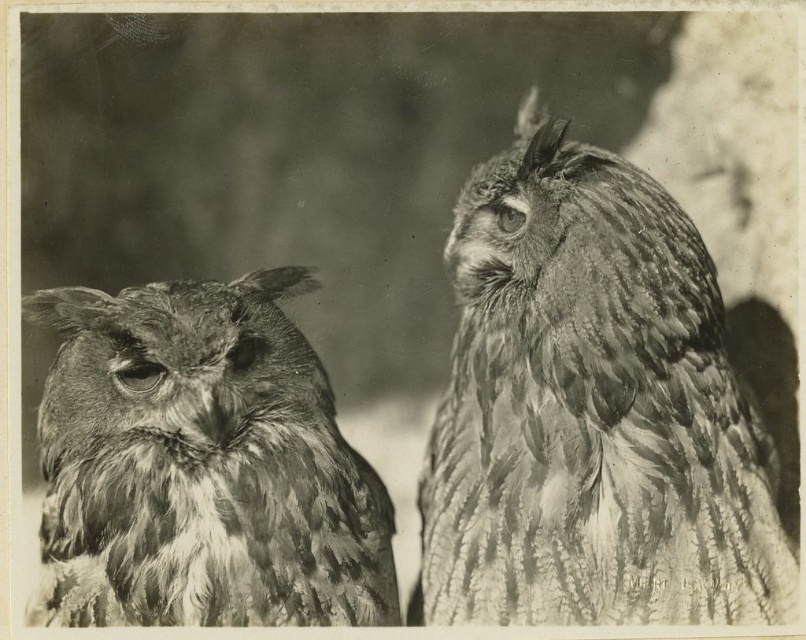
You are a photographer trying to capture a closeup shot of both owls in the image. Given their positions at point coordinates point [624,365] and point [104,595], which owl should you focus on first to ensure both are in sharp focus?

You should focus on the owl at point [104,595] first because it is closer to the camera than the owl at point [624,365], which is further away. By focusing on the closer owl, the depth of field may help keep both in focus.

You are a photographer who wants to capture a closeup shot of the ruffled feather owl at right without the rough feathered owl at left appearing in the background. Is this possible given their positions?

The ruffled feather owl at right is located above the rough feathered owl at left, so if you position your camera to focus on the ruffled feather owl at right and adjust the depth of field to blur the background, the rough feathered owl at left might still appear in the background unless the distance between them is sufficient. However, since the rough feathered owl at left is in the foreground and the ruffled feather owl at right is behind it, this might not be feasible without moving the camera angle or

You are a photographer trying to capture both owls in a single frame. Given that your camera has a depth of field that can focus on objects within 10 inches of each other, will both the ruffled feather owl at right and the rough feathered owl at left be in focus?

The ruffled feather owl at right is 11.23 inches from the rough feathered owl at left. Since the distance between them exceeds the camera lens depth of field limit of 10 inches, only one of the owls will be in focus while the other will appear blurry.